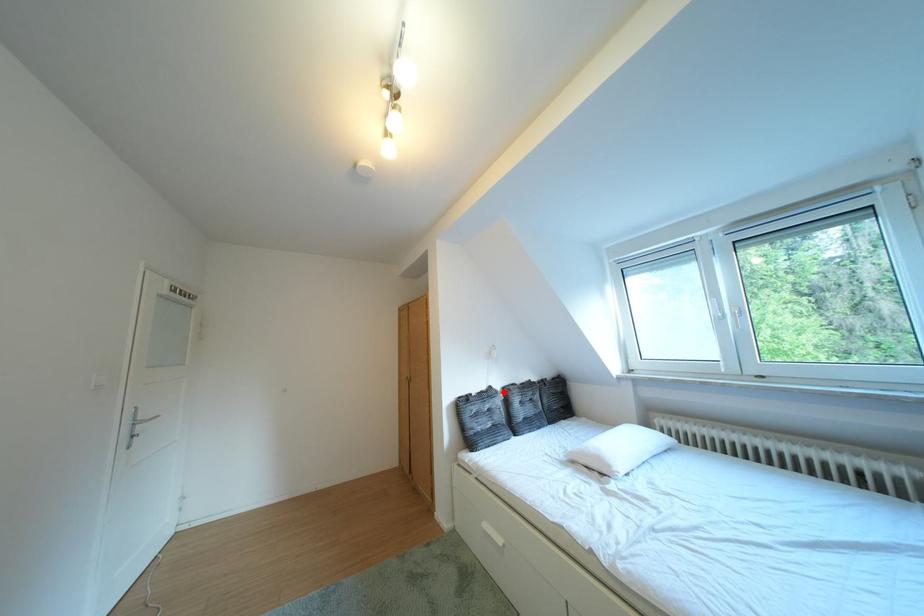
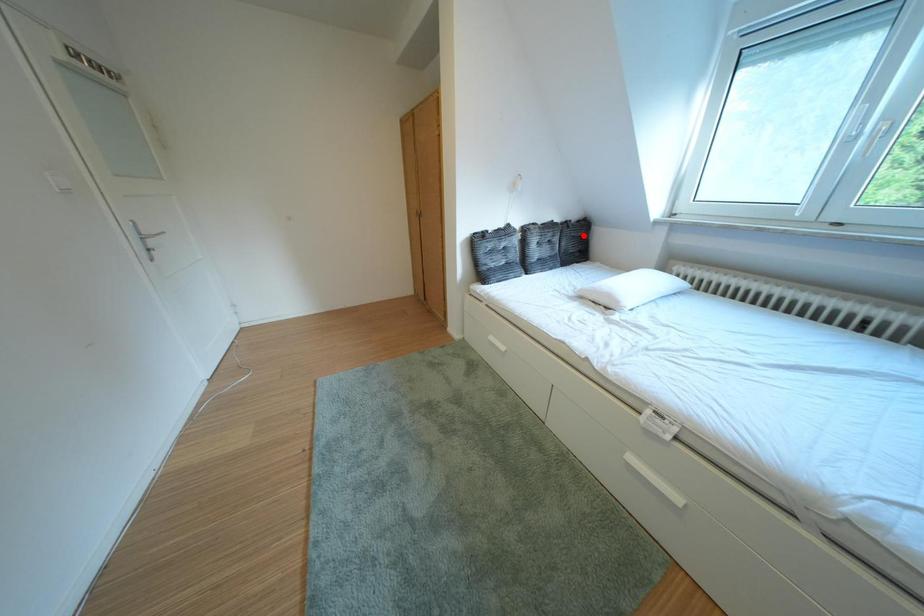
I am providing you with two images of the same scene from different viewpoints. A red point is marked on the first image and another point is marked on the second image. Is the red point in image1 aligned with the point shown in image2?

No